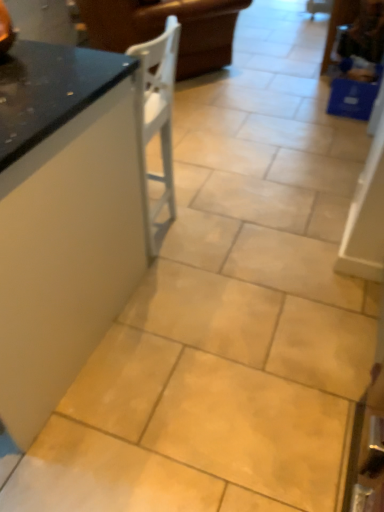
Identify the location of free location to the right of white wood chair at upper left. pos(281,86).